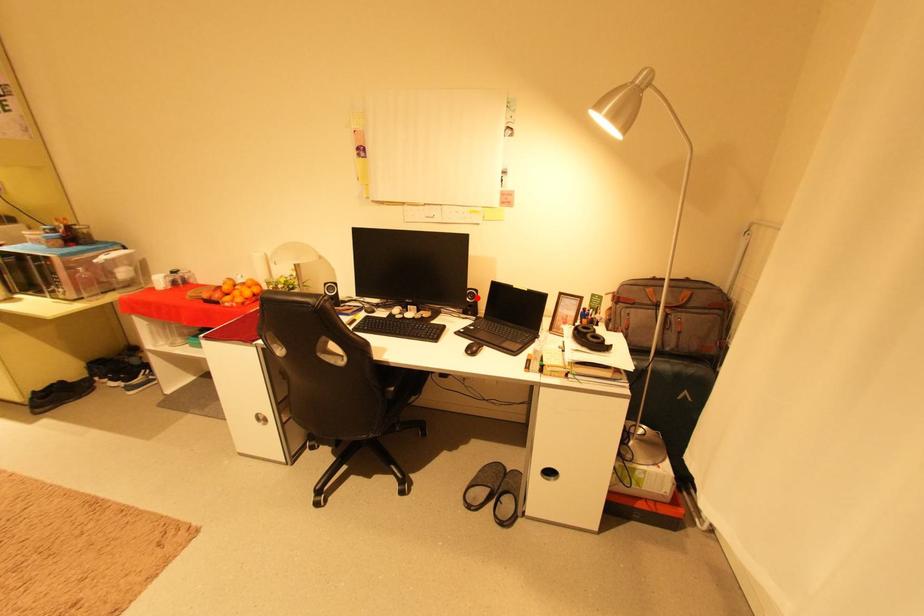
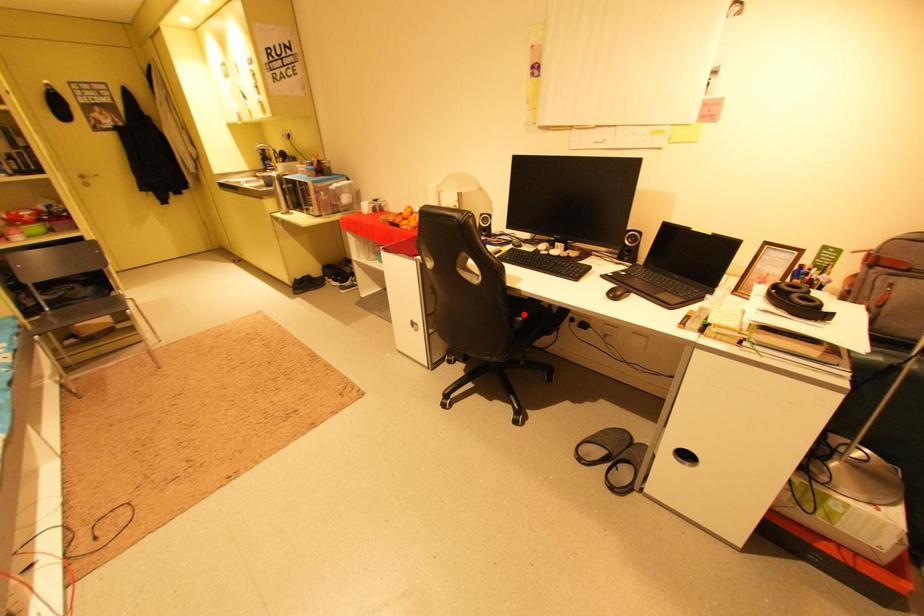
I am providing you with two images of the same scene from different viewpoints. A red point is marked on the first image and another point is marked on the second image. Are the points marked in image1 and image2 representing the same 3D position?

No